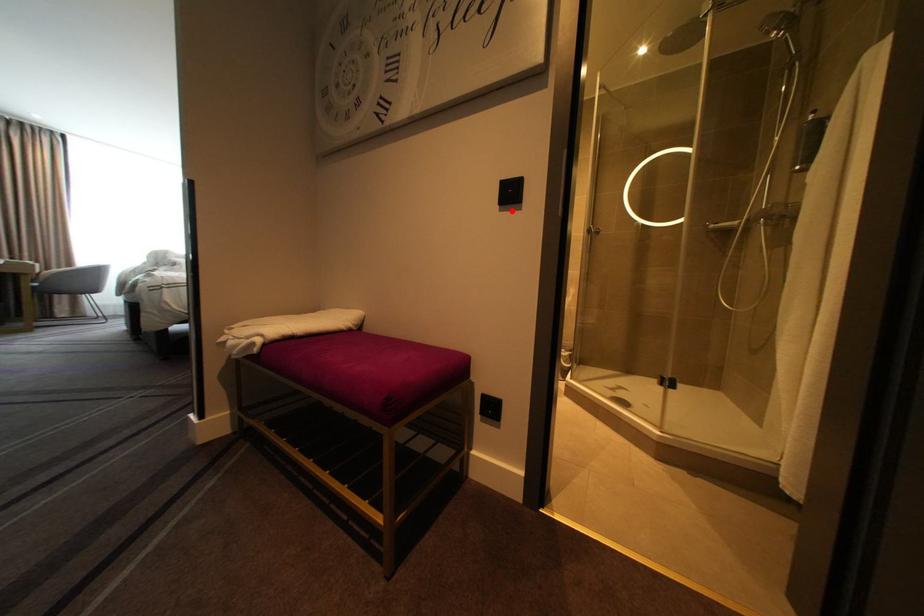
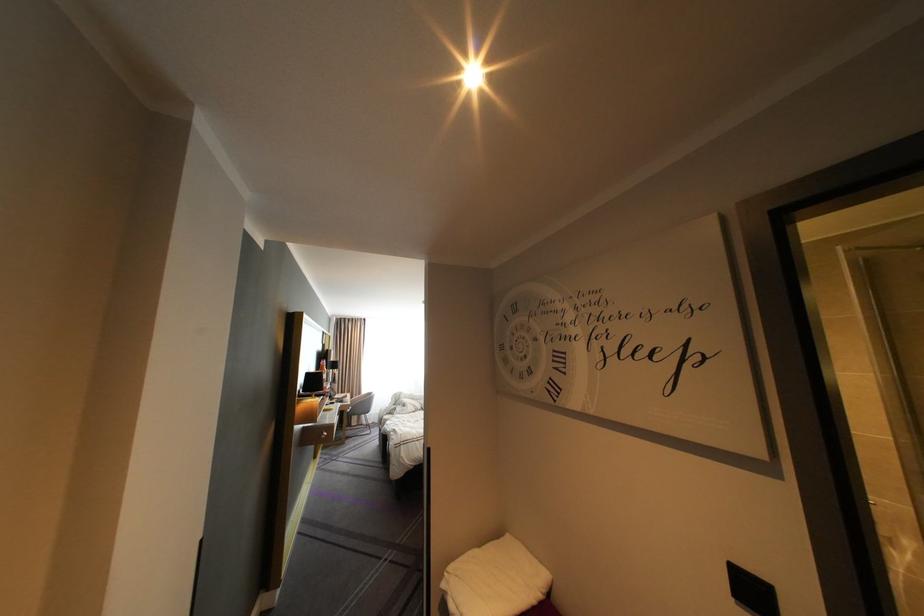
Find the pixel in the second image that matches the highlighted location in the first image.

(748, 604)